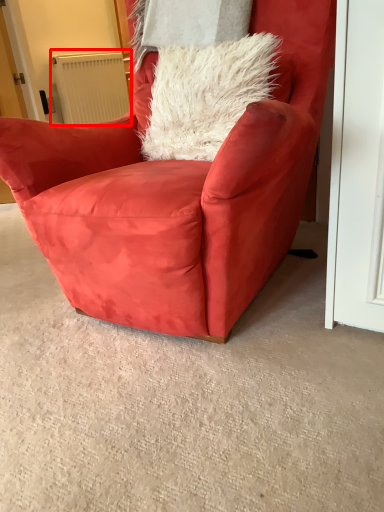
Question: Observing the image, what is the correct spatial positioning of radiator (annotated by the red box) in reference to chair?

Choices:
 (A) left
 (B) right

Answer: (A)